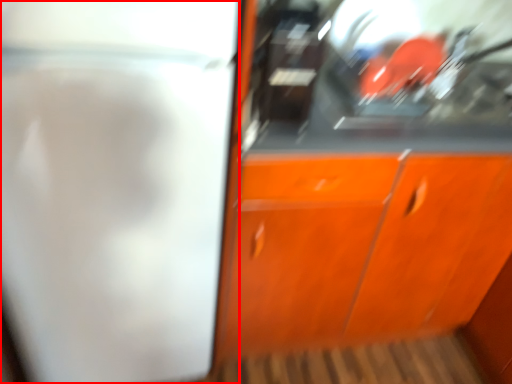
Question: In this image, where is screen door (annotated by the red box) located relative to cabinetry?

Choices:
 (A) left
 (B) right

Answer: (A)